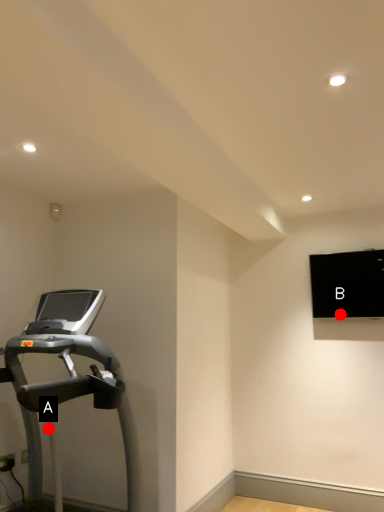
Question: Two points are circled on the image, labeled by A and B beside each circle. Which point appears farthest from the camera in this image?

Choices:
 (A) A is further
 (B) B is further

Answer: (B)